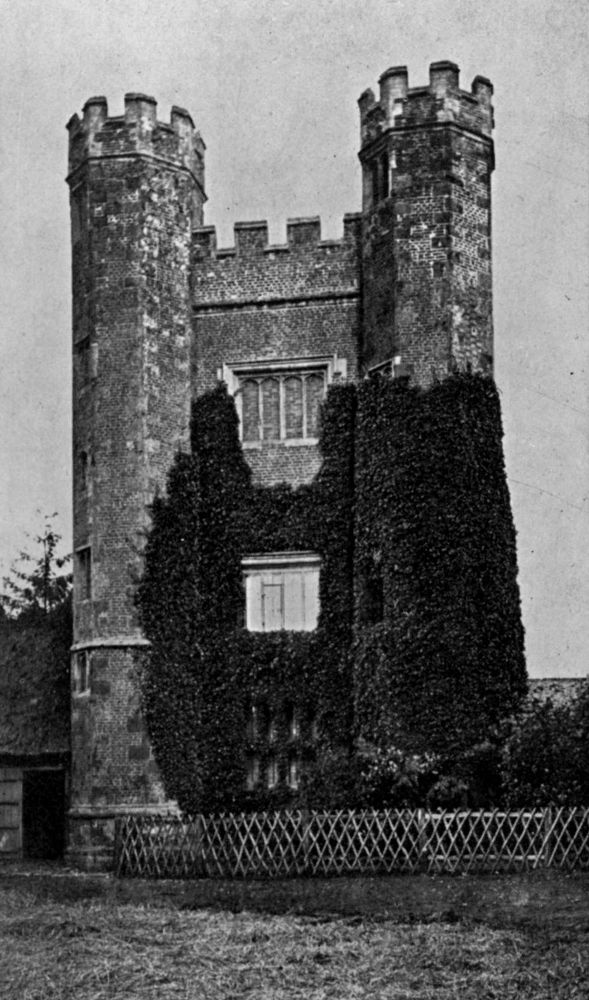
Where is `window`? This screenshot has height=1000, width=589. window is located at coordinates (291, 411), (274, 600).